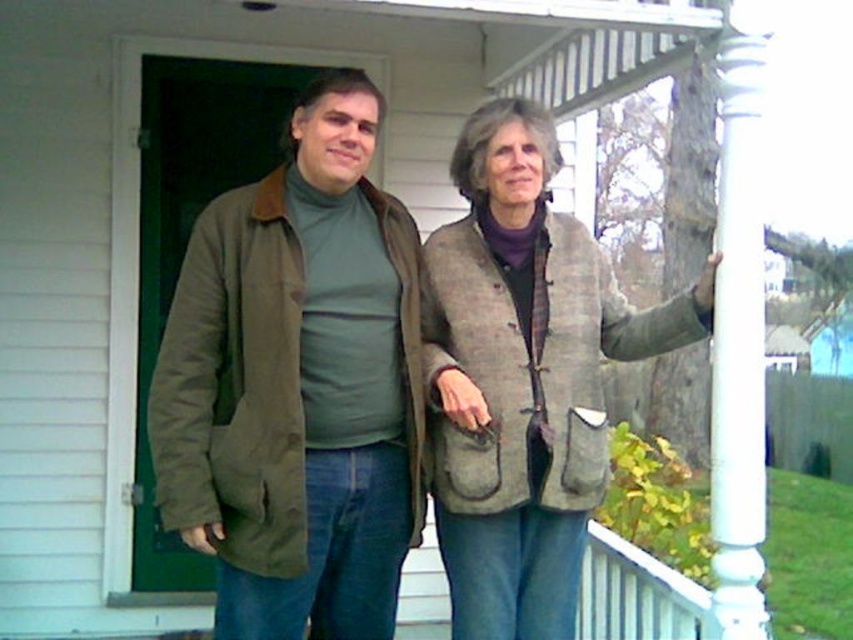
You are standing in front of the house and see the point marked at coordinates [299,385]. What object is located at that point?

The matte olive green jacket at center is represented by point [299,385].

You are standing in front of the house and see the point at coordinates (299, 385). What object is located at that point?

The matte olive green jacket at center is located at point (299, 385).